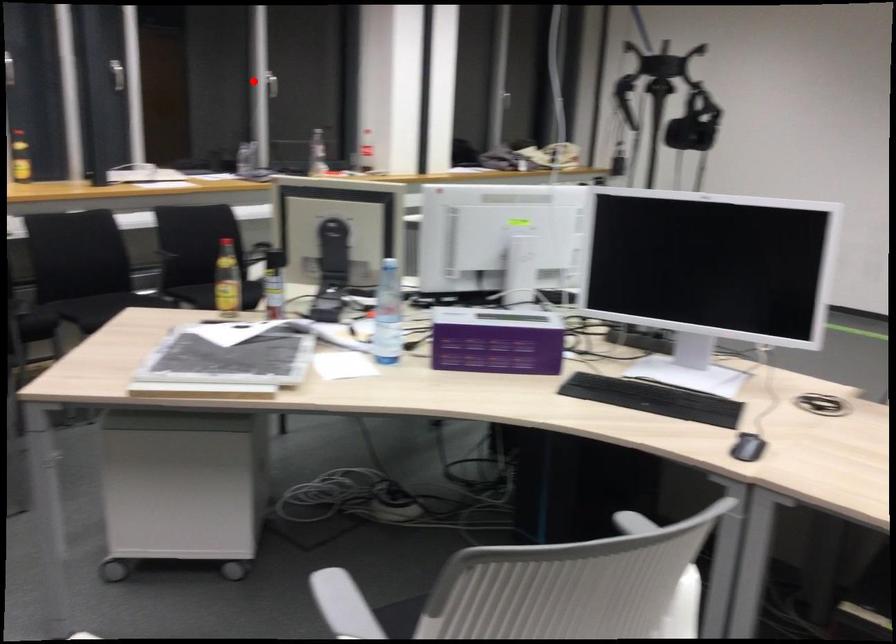
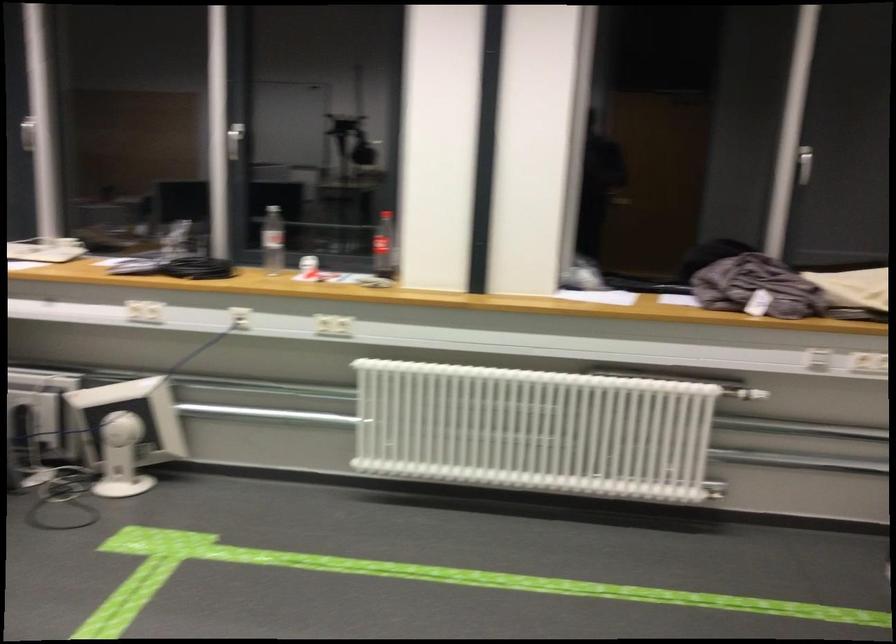
Question: I am providing you with two images of the same scene from different viewpoints. In image1, a red point is highlighted. Considering the same 3D point in image2, which of the following is correct?

Choices:
 (A) It is closer
 (B) It is farther

Answer: (A)